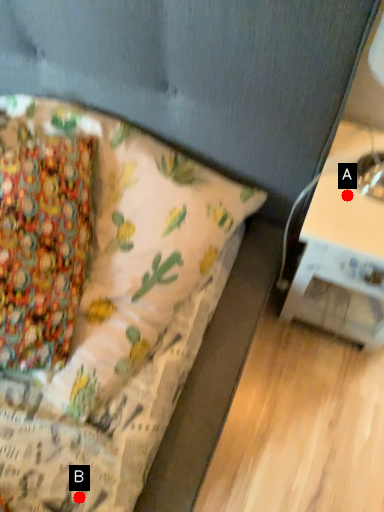
Question: Two points are circled on the image, labeled by A and B beside each circle. Among these points, which one is nearest to the camera?

Choices:
 (A) A is closer
 (B) B is closer

Answer: (B)